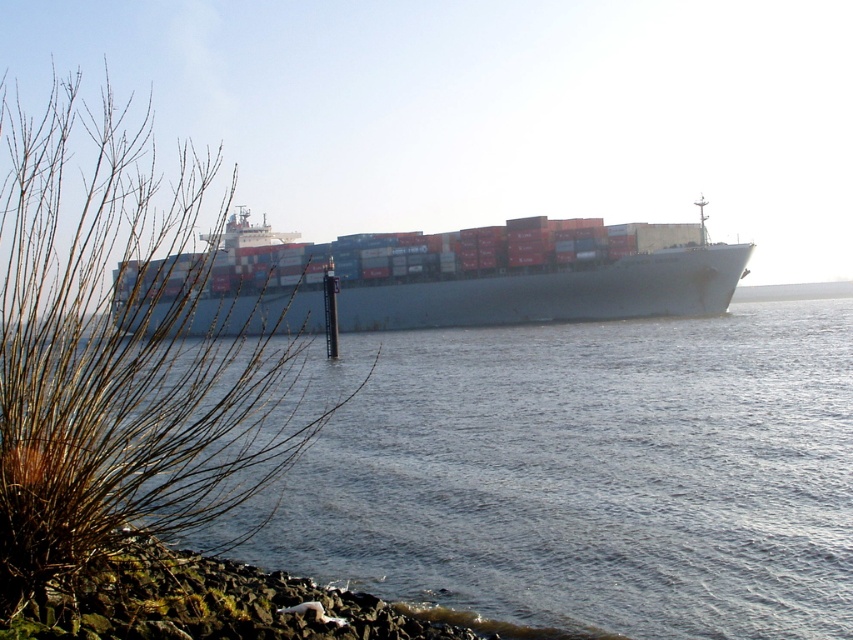
Who is taller, gray water at center or blue matte container ship at center?

Standing taller between the two is blue matte container ship at center.

Describe the element at coordinates (593, 474) in the screenshot. I see `gray water at center` at that location.

What do you see at coordinates (593, 474) in the screenshot?
I see `gray water at center` at bounding box center [593, 474].

The height and width of the screenshot is (640, 853). I want to click on gray water at center, so click(593, 474).

Is the position of brown dry grass at left more distant than that of blue matte container ship at center?

Yes, it is behind blue matte container ship at center.

Between point (3, 408) and point (479, 237), which one is positioned in front?

Point (3, 408) is in front.

I want to click on brown dry grass at left, so click(x=119, y=355).

Is gray water at center further to camera compared to brown dry grass at left?

Yes, gray water at center is behind brown dry grass at left.

Is point (364, 520) behind point (134, 483)?

Yes, it is.

Locate an element on the screen. This screenshot has height=640, width=853. gray water at center is located at coordinates (593, 474).